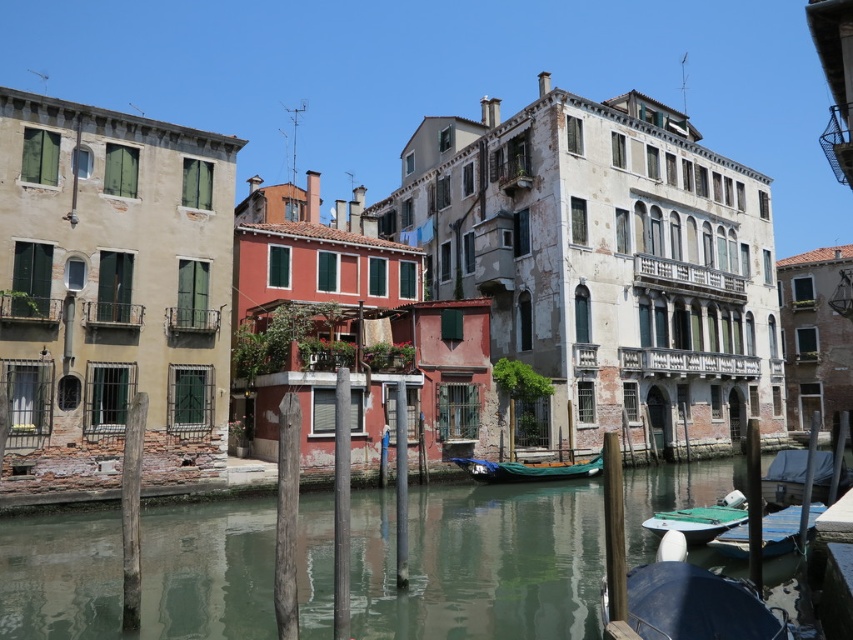
Based on the photo, you are a tourist standing at the edge of the canal, wanting to take a photo of both the blue tarpaulin boat at lower right and the green canvas boat at center. Which boat should you aim your camera at first to ensure both are in the frame?

The blue tarpaulin boat at lower right is located above the green canvas boat at center, so you should aim your camera at the blue tarpaulin boat at lower right first to include both in the frame.

You are a tourist in Venice and want to take a photo of both green canvas boat at lower right and green canvas boat at center. Which boat should you stand closer to in order to capture both in a single frame?

You should stand closer to the green canvas boat at lower right because it is shorter than the green canvas boat at center, allowing both to fit within the frame more easily.